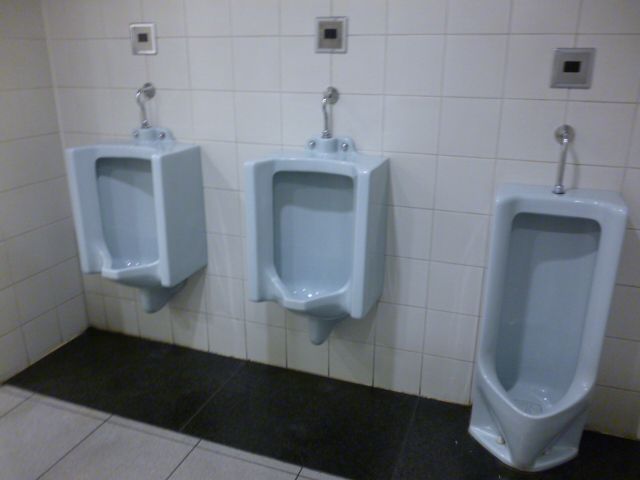
Where is `tile on floor`? This screenshot has height=480, width=640. tile on floor is located at coordinates (12, 396), (22, 393), (47, 397), (40, 419), (106, 447), (131, 426), (221, 448), (212, 461), (301, 478), (314, 473).